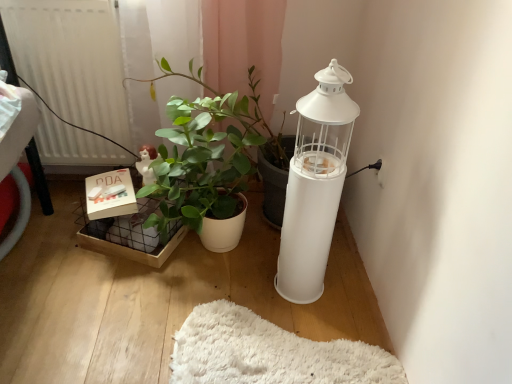
Question: Would you consider matte white figurine at center-left to be distant from white matte radiator at left?

Choices:
 (A) no
 (B) yes

Answer: (A)

Question: Is matte white figurine at center-left with white matte radiator at left?

Choices:
 (A) yes
 (B) no

Answer: (B)

Question: From a real-world perspective, is matte white figurine at center-left beneath white matte radiator at left?

Choices:
 (A) no
 (B) yes

Answer: (B)

Question: Is matte white figurine at center-left facing towards white matte radiator at left?

Choices:
 (A) yes
 (B) no

Answer: (B)

Question: Is matte white figurine at center-left to the right of white matte radiator at left from the viewer's perspective?

Choices:
 (A) no
 (B) yes

Answer: (B)

Question: Is point (324, 96) closer or farther from the camera than point (134, 193)?

Choices:
 (A) closer
 (B) farther

Answer: (A)

Question: Is white matte lantern at right inside or outside of matte white box at lower left?

Choices:
 (A) inside
 (B) outside

Answer: (B)

Question: From a real-world perspective, is white matte lantern at right physically located above or below matte white box at lower left?

Choices:
 (A) above
 (B) below

Answer: (A)

Question: Relative to matte white box at lower left, is white matte lantern at right in front or behind?

Choices:
 (A) front
 (B) behind

Answer: (A)

Question: Is matte white box at lower left bigger or smaller than white matte radiator at left?

Choices:
 (A) big
 (B) small

Answer: (B)

Question: Considering the positions of point (102, 205) and point (79, 51), is point (102, 205) closer or farther from the camera than point (79, 51)?

Choices:
 (A) farther
 (B) closer

Answer: (B)

Question: From the image's perspective, relative to white matte radiator at left, is matte white box at lower left above or below?

Choices:
 (A) above
 (B) below

Answer: (B)

Question: From a real-world perspective, is matte white box at lower left positioned above or below white matte radiator at left?

Choices:
 (A) above
 (B) below

Answer: (B)

Question: From their relative heights in the image, would you say white matte radiator at left is taller or shorter than white matte lantern at right?

Choices:
 (A) tall
 (B) short

Answer: (B)

Question: In terms of width, does white matte radiator at left look wider or thinner when compared to white matte lantern at right?

Choices:
 (A) wide
 (B) thin

Answer: (B)